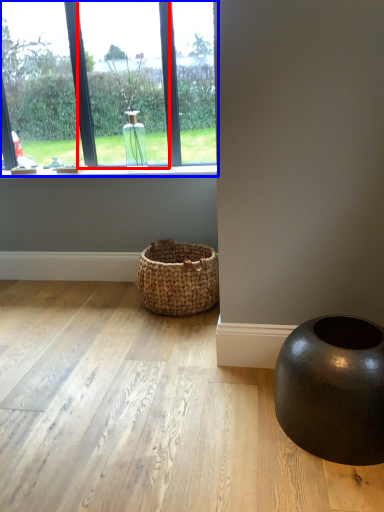
Question: Which object appears farthest to the camera in this image, window (highlighted by a red box) or window (highlighted by a blue box)?

Choices:
 (A) window
 (B) window

Answer: (B)